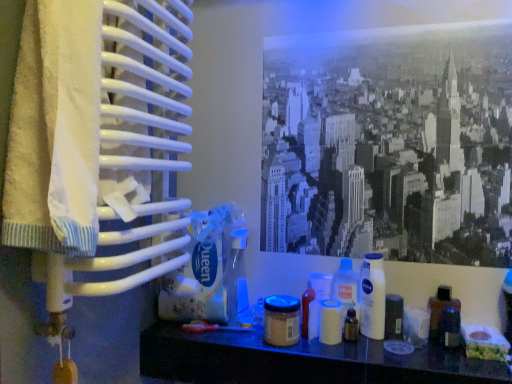
The image size is (512, 384). Find the location of `free spot to the right of translucent plastic tube at center, the fifth toiletry from the right`. free spot to the right of translucent plastic tube at center, the fifth toiletry from the right is located at coordinates (382, 357).